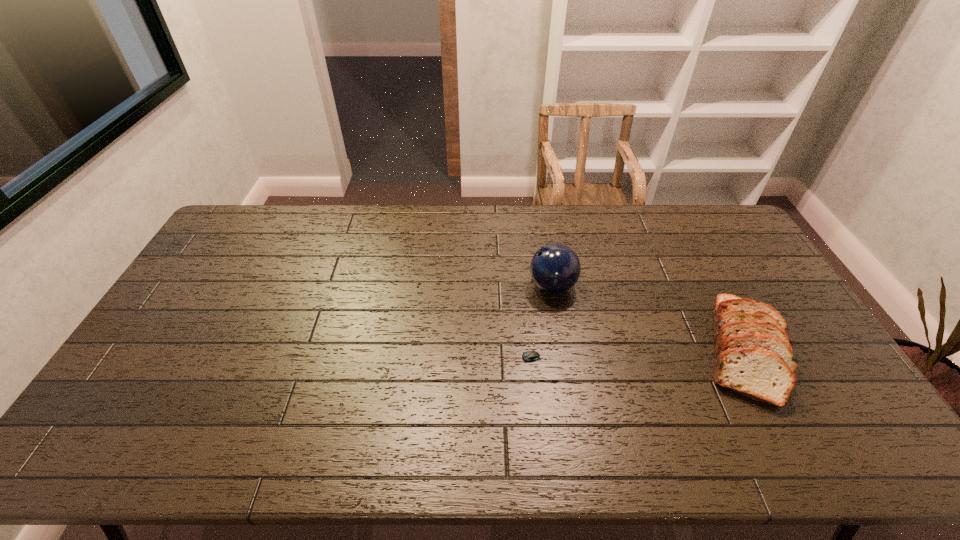
Where is `vacant space that satisfies the following two spatial constraints: 1. on the back side of the second tallest object; 2. on the surface of the bowling ball near the finger holes`? Image resolution: width=960 pixels, height=540 pixels. vacant space that satisfies the following two spatial constraints: 1. on the back side of the second tallest object; 2. on the surface of the bowling ball near the finger holes is located at coordinates (710, 286).

Locate an element on the screen. Image resolution: width=960 pixels, height=540 pixels. free spot that satisfies the following two spatial constraints: 1. on the surface of the bowling ball near the finger holes; 2. on the back side of the rightmost object is located at coordinates (563, 350).

The image size is (960, 540). I want to click on free space that satisfies the following two spatial constraints: 1. on the surface of the bread near the finger holes; 2. on the right side of the tallest object, so click(x=563, y=350).

The width and height of the screenshot is (960, 540). What are the coordinates of `vacant area that satisfies the following two spatial constraints: 1. on the surface of the bowling ball near the finger holes; 2. on the back side of the second shortest object` in the screenshot? It's located at (563, 350).

This screenshot has width=960, height=540. Find the location of `free location that satisfies the following two spatial constraints: 1. on the surface of the bowling ball near the finger holes; 2. on the right side of the bread`. free location that satisfies the following two spatial constraints: 1. on the surface of the bowling ball near the finger holes; 2. on the right side of the bread is located at coordinates (563, 350).

Where is `vacant area that satisfies the following two spatial constraints: 1. on the surface of the tallest object near the finger holes; 2. on the left side of the bread`? The width and height of the screenshot is (960, 540). vacant area that satisfies the following two spatial constraints: 1. on the surface of the tallest object near the finger holes; 2. on the left side of the bread is located at coordinates coord(563,350).